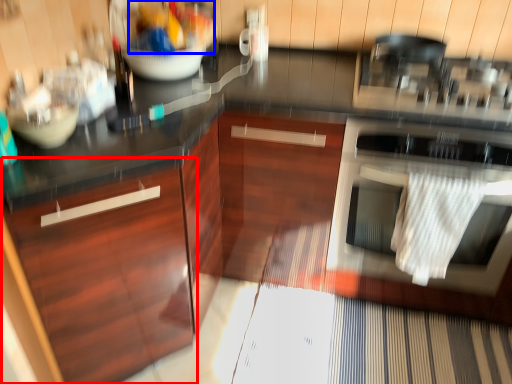
Question: Which of the following is the closest to the observer, cabinetry (highlighted by a red box) or food (highlighted by a blue box)?

Choices:
 (A) cabinetry
 (B) food

Answer: (A)